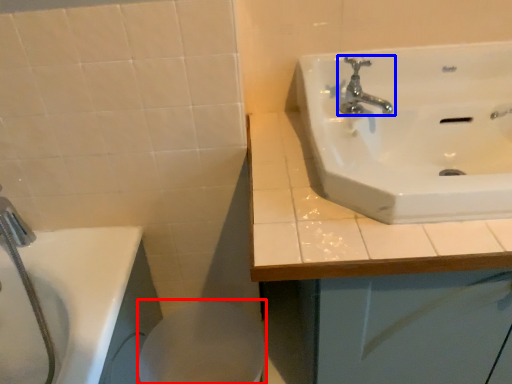
Question: Which point is further to the camera, bidet (highlighted by a red box) or tap (highlighted by a blue box)?

Choices:
 (A) bidet
 (B) tap

Answer: (A)